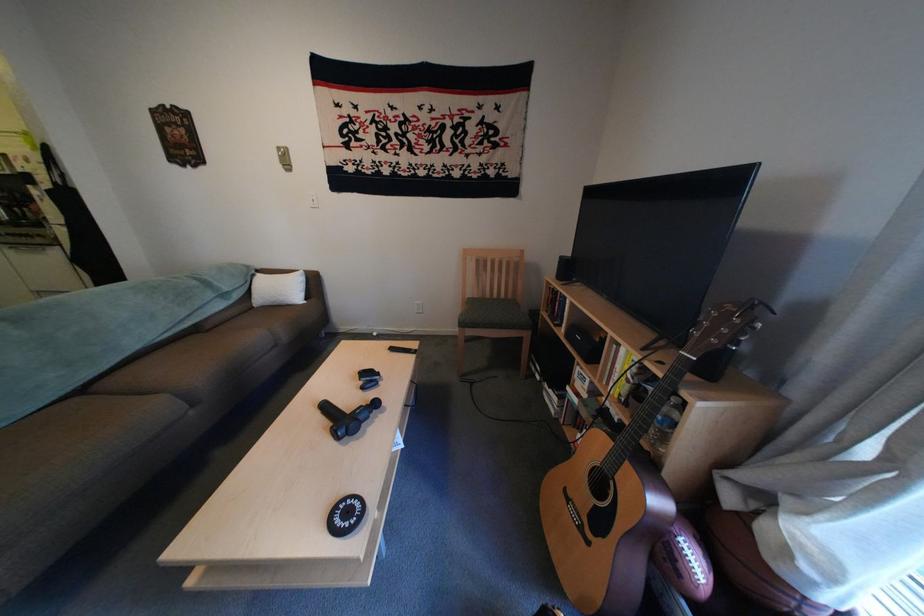
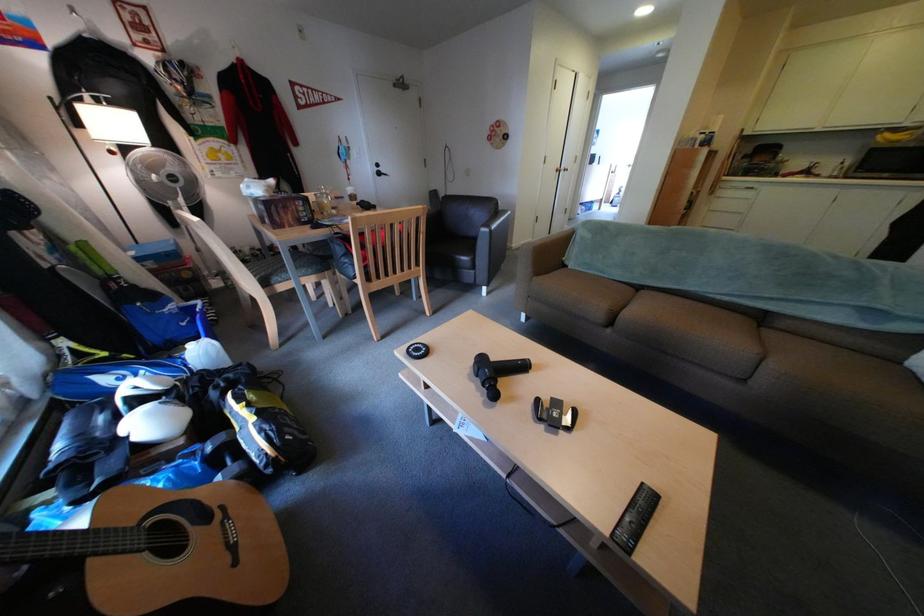
Find the pixel in the second image that matches (629,479) in the first image.

(148, 527)